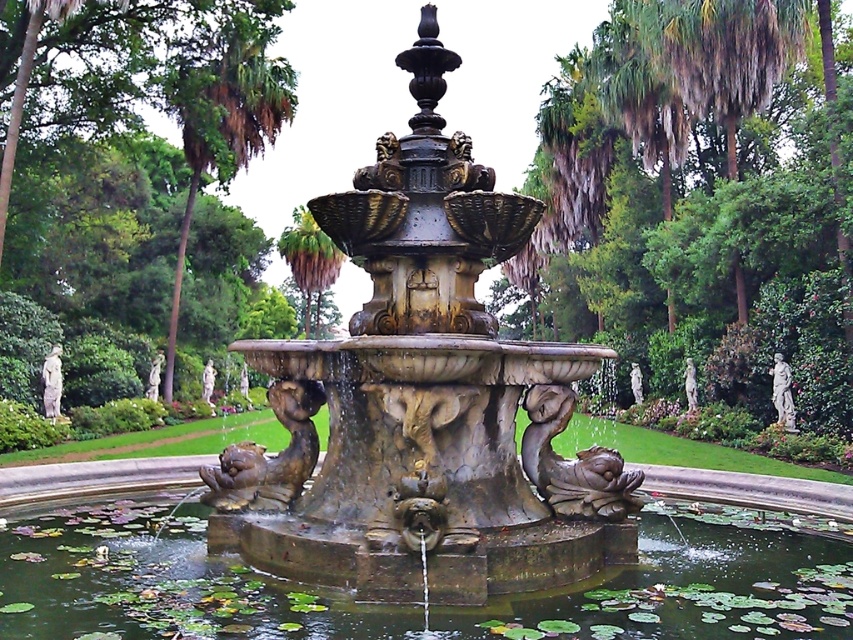
Does bronze fountain at center have a lesser width compared to green leafy palm tree at center?

Indeed, bronze fountain at center has a lesser width compared to green leafy palm tree at center.

Find the location of a particular element. This screenshot has height=640, width=853. bronze fountain at center is located at coordinates (422, 401).

Measure the distance between point (633, 490) and camera.

A distance of 6.50 meters exists between point (633, 490) and camera.

Where is `bronze fountain at center`? This screenshot has width=853, height=640. bronze fountain at center is located at coordinates (422, 401).

Who is lower down, bronze fountain at center or green mossy water at center?

green mossy water at center

Where is `bronze fountain at center`? bronze fountain at center is located at coordinates (422, 401).

Is the position of green mossy water at center more distant than that of green leafy palm tree at upper center?

No, green mossy water at center is closer to the viewer.

Does green mossy water at center appear on the left side of green leafy palm tree at upper center?

In fact, green mossy water at center is to the right of green leafy palm tree at upper center.

Measure the distance between point [395,614] and camera.

Point [395,614] is 5.15 meters away from camera.

Locate an element on the screen. green mossy water at center is located at coordinates (421, 600).